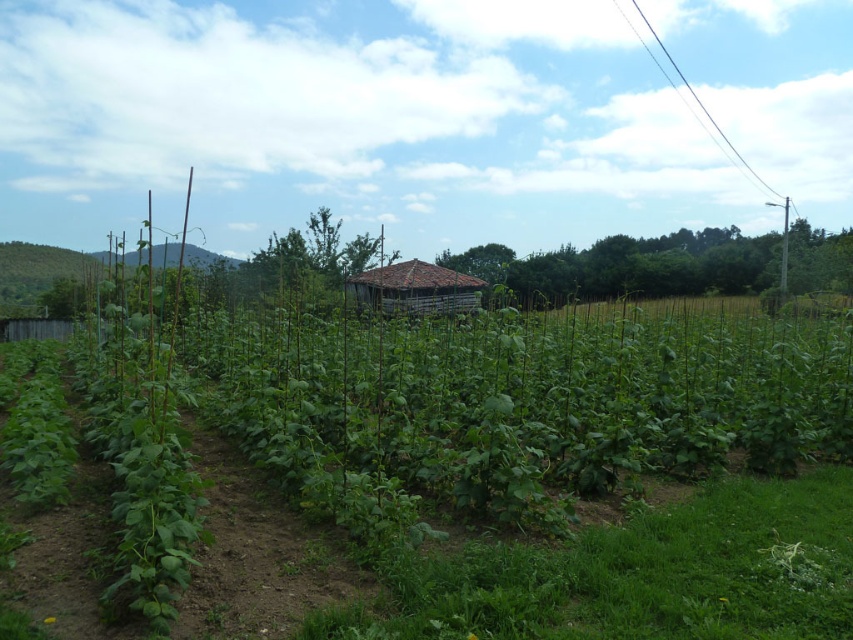
You are a farmer who wants to plant a new row of crops between the green leafy plants at center and the brown wooden hut at center. Considering their sizes, which object will require more space for the new row?

The green leafy plants at center has a larger size compared to the brown wooden hut at center, so the new row will need more space near the green leafy plants at center.

You are a farmer checking the spacing between the green leafy plants at center. The recommended spacing for optimal growth is 4 meters. Based on the image, is the current spacing sufficient?

The green leafy plants at center are 3.91 meters apart, which is slightly less than the recommended 4 meters. The spacing is almost sufficient but slightly too close for optimal growth.